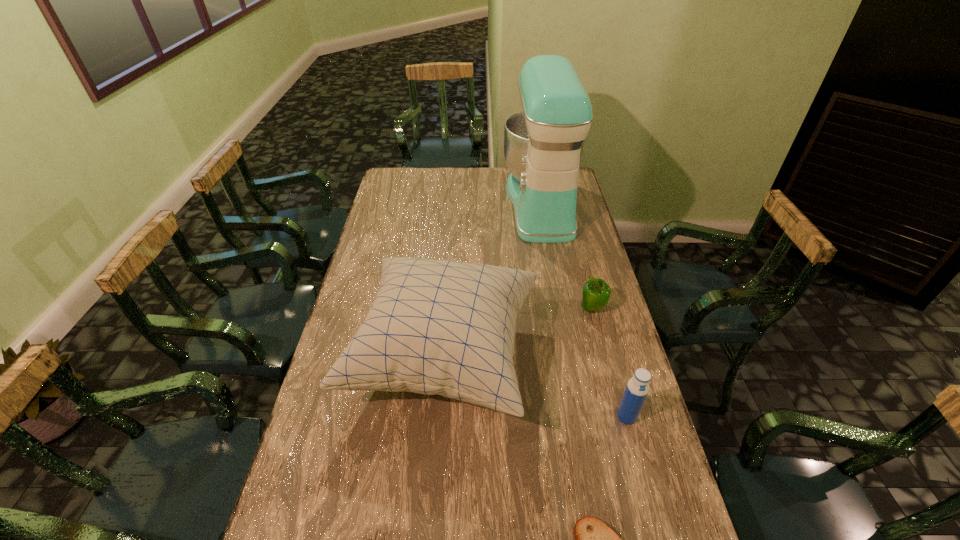
Where is `mixer`? mixer is located at coordinates (543, 144).

You are a GUI agent. You are given a task and a screenshot of the screen. Output one action in this format:
    pyautogui.click(x=<x>, y=<y>)
    Task: Click on the farthest object
    
    Given the screenshot: What is the action you would take?
    543,144

The width and height of the screenshot is (960, 540). Find the location of `the fifth shortest object`. the fifth shortest object is located at coordinates (444, 327).

Find the location of a particular element. Image resolution: width=960 pixels, height=540 pixels. the third tallest object is located at coordinates tap(637, 388).

Identify the location of the fourth tallest object. This screenshot has width=960, height=540. (596, 293).

You are a GUI agent. You are given a task and a screenshot of the screen. Output one action in this format:
    pyautogui.click(x=<x>, y=<y>)
    Task: Click on the vacant space situated at the base of the farthest object
    This screenshot has height=540, width=960.
    Given the screenshot: What is the action you would take?
    pyautogui.click(x=423, y=205)

Identify the location of vacant region located 0.100m at the base of the farthest object. (481, 205).

What are the coordinates of `vacant space located at the base of the farthest object` in the screenshot? It's located at (432, 205).

In order to click on free spot located 0.390m on the back of the second tallest object in this screenshot , I will do pyautogui.click(x=454, y=227).

The width and height of the screenshot is (960, 540). Find the location of `vacant space located on the back of the water bottle`. vacant space located on the back of the water bottle is located at coordinates (598, 313).